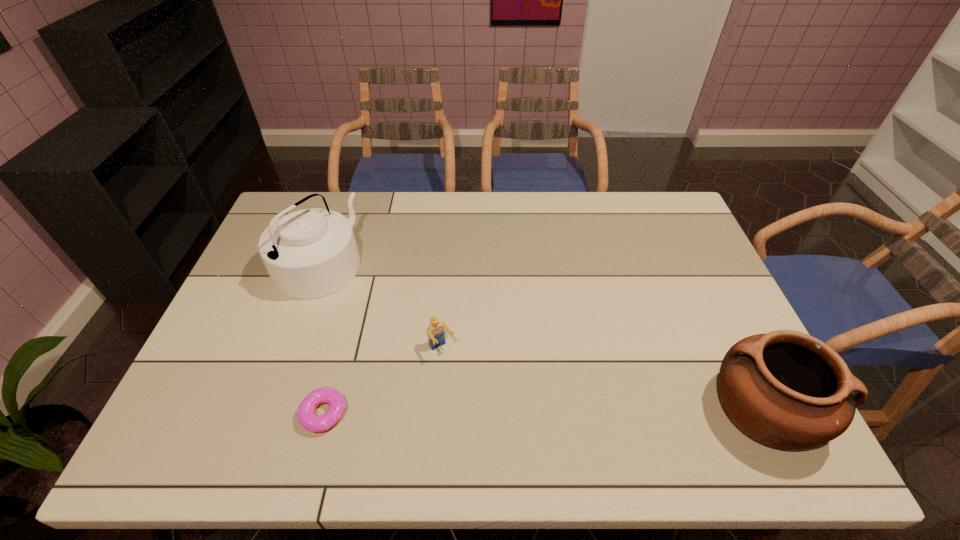
Identify the location of object located in the far left corner section of the desktop. The height and width of the screenshot is (540, 960). (310, 253).

The height and width of the screenshot is (540, 960). Find the location of `object that is positioned at the near right corner`. object that is positioned at the near right corner is located at coordinates (785, 389).

Locate an element on the screen. The width and height of the screenshot is (960, 540). free location at the far edge of the desktop is located at coordinates (509, 208).

Where is `vacant space at the near edge of the desktop`? This screenshot has width=960, height=540. vacant space at the near edge of the desktop is located at coordinates (539, 386).

Where is `free location at the left edge of the desktop`? Image resolution: width=960 pixels, height=540 pixels. free location at the left edge of the desktop is located at coordinates (248, 289).

The image size is (960, 540). Find the location of `blank area at the right edge`. blank area at the right edge is located at coordinates (686, 246).

The height and width of the screenshot is (540, 960). In order to click on vacant region at the far right corner of the desktop in this screenshot , I will do `click(657, 206)`.

Where is `free space between the farthest object and the shortest object`? The image size is (960, 540). free space between the farthest object and the shortest object is located at coordinates (x=322, y=339).

Locate an element on the screen. The height and width of the screenshot is (540, 960). free point between the Lego and the rightmost object is located at coordinates (602, 379).

Where is `free spot between the pottery and the farthest object`? The height and width of the screenshot is (540, 960). free spot between the pottery and the farthest object is located at coordinates (540, 336).